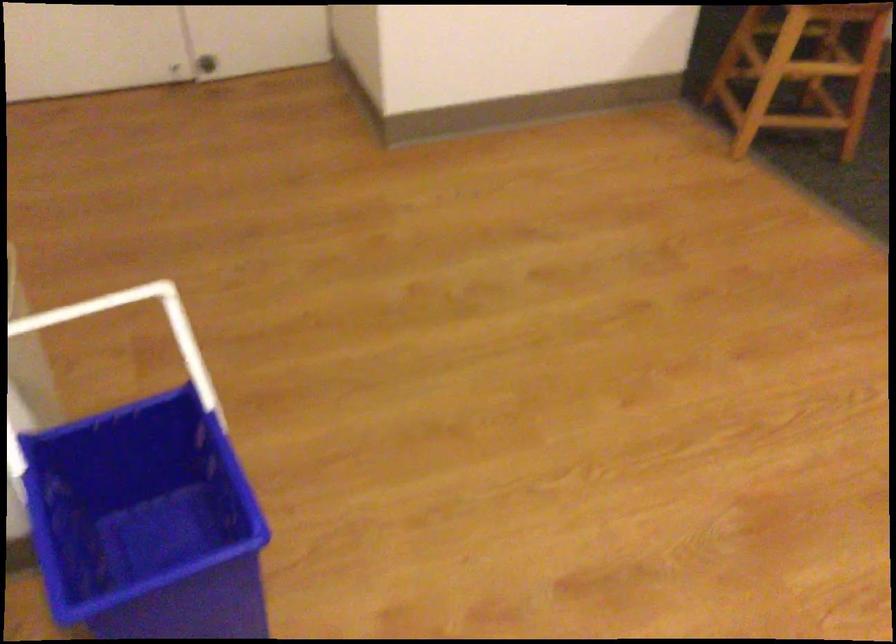
What do you see at coordinates (794, 90) in the screenshot?
I see `a wooden stool step` at bounding box center [794, 90].